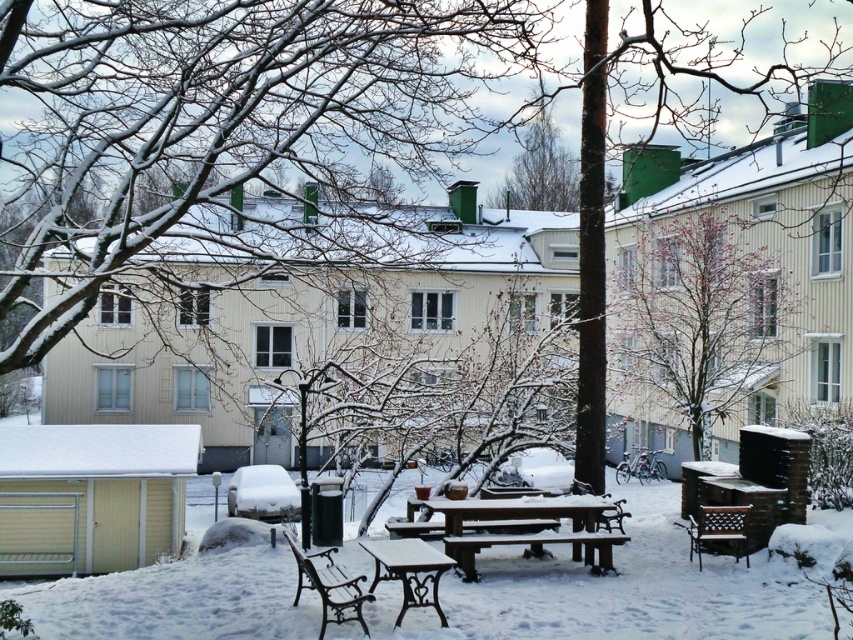
You are standing at the entrance of the courtyard and want to find the wooden picnic table at center. According to the coordinates, where should you look in the image?

The wooden picnic table at center is located at coordinates point (525, 531) in the image.

You are planning to place a rectangular picnic basket on the white painted wood table at center. The basket is 1.2 meters wide. Can the table accommodate the basket without overhanging the edges? Please consider the wooden bench at center nearby.

The white painted wood table at center has a width less than the wooden bench at center. Since the table is narrower than the bench, and the basket is 1.2 meters wide, it is likely that the table cannot fully accommodate the basket without overhanging the edges unless the bench is moved.

You are standing in the snow covered courtyard and want to reach a point that is 13.18 meters away. Is the point at point (593, 540) within the courtyard?

The point at point (593, 540) is 13.18 meters away from the viewer, so yes, it is within the courtyard.